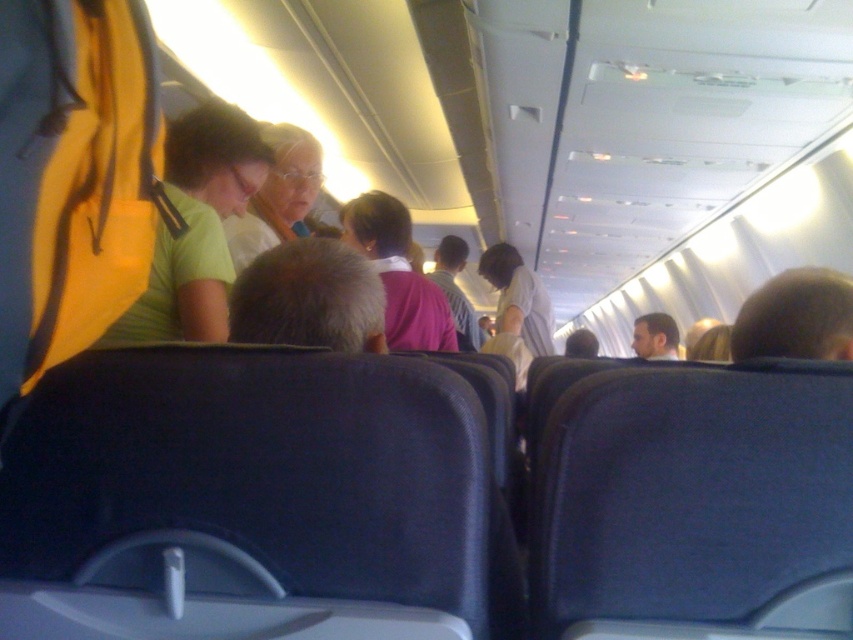
Question: Can you confirm if green matte shirt at upper left is bigger than white fabric flight attendant at center?

Choices:
 (A) yes
 (B) no

Answer: (B)

Question: Is green matte shirt at upper left bigger than white fabric flight attendant at center?

Choices:
 (A) yes
 (B) no

Answer: (B)

Question: Which point is farther to the camera?

Choices:
 (A) (189, 289)
 (B) (520, 289)

Answer: (B)

Question: Considering the relative positions of green matte shirt at upper left and white fabric flight attendant at center in the image provided, where is green matte shirt at upper left located with respect to white fabric flight attendant at center?

Choices:
 (A) right
 (B) left

Answer: (B)

Question: Which point is farther from the camera taking this photo?

Choices:
 (A) (170, 284)
 (B) (512, 330)

Answer: (B)